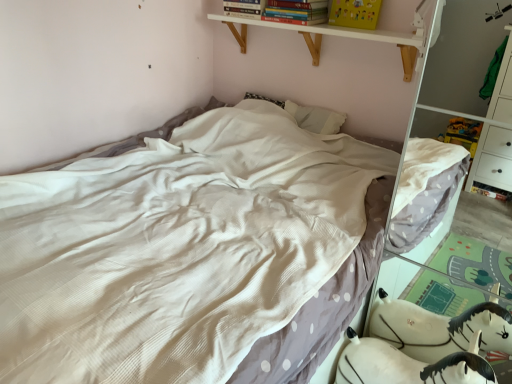
Question: Does white wood shelf at upper center have a smaller size compared to white plush toy at lower right?

Choices:
 (A) yes
 (B) no

Answer: (A)

Question: From the image's perspective, is white wood shelf at upper center under white plush toy at lower right?

Choices:
 (A) no
 (B) yes

Answer: (A)

Question: From a real-world perspective, is white wood shelf at upper center beneath white plush toy at lower right?

Choices:
 (A) no
 (B) yes

Answer: (A)

Question: Does white wood shelf at upper center come behind white plush toy at lower right?

Choices:
 (A) yes
 (B) no

Answer: (A)

Question: Is white plush toy at lower right completely or partially inside white wood shelf at upper center?

Choices:
 (A) no
 (B) yes

Answer: (A)

Question: Can you confirm if white wood shelf at upper center is taller than white plush toy at lower right?

Choices:
 (A) no
 (B) yes

Answer: (A)

Question: Does hardcover book at upper center, the 1th book viewed from the right, lie behind white textured bed at center?

Choices:
 (A) no
 (B) yes

Answer: (B)

Question: Does hardcover book at upper center, placed as the 2th book when sorted from left to right, appear on the left side of white textured bed at center?

Choices:
 (A) yes
 (B) no

Answer: (B)

Question: Is hardcover book at upper center, the 1th book viewed from the right, taller than white textured bed at center?

Choices:
 (A) no
 (B) yes

Answer: (A)

Question: Is hardcover book at upper center, placed as the 2th book when sorted from left to right, positioned in front of white textured bed at center?

Choices:
 (A) no
 (B) yes

Answer: (A)

Question: Is hardcover book at upper center, the 1th book viewed from the right, bigger than white textured bed at center?

Choices:
 (A) no
 (B) yes

Answer: (A)

Question: Is hardcover book at upper center, placed as the 2th book when sorted from left to right, positioned far away from white textured bed at center?

Choices:
 (A) no
 (B) yes

Answer: (B)

Question: From the image's perspective, is white plush toy at lower right under white wood shelf at upper center?

Choices:
 (A) yes
 (B) no

Answer: (A)